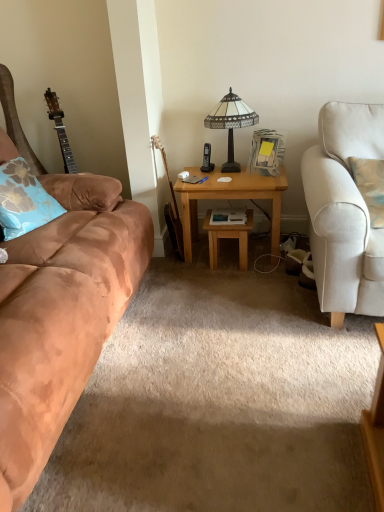
At what (x,y) coordinates should I click in order to perform the action: click on free spot to the left of wooden table at center. Please return your answer as a coordinate pair (x, y). Looking at the image, I should click on (195, 265).